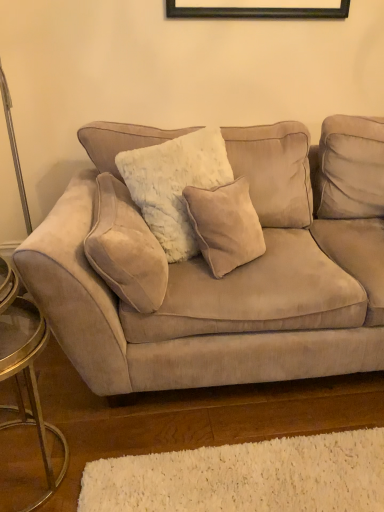
Question: From the image's perspective, is beige suede pillow at left beneath suede couch at center?

Choices:
 (A) no
 (B) yes

Answer: (B)

Question: Is beige suede pillow at left taller than suede couch at center?

Choices:
 (A) yes
 (B) no

Answer: (B)

Question: Does beige suede pillow at left have a greater width compared to suede couch at center?

Choices:
 (A) yes
 (B) no

Answer: (B)

Question: Does beige suede pillow at left have a smaller size compared to suede couch at center?

Choices:
 (A) yes
 (B) no

Answer: (A)

Question: Is beige suede pillow at left at the right side of suede couch at center?

Choices:
 (A) yes
 (B) no

Answer: (B)

Question: From the image's perspective, is beige suede pillow at left above or below white shag rug at lower center?

Choices:
 (A) above
 (B) below

Answer: (A)

Question: Is beige suede pillow at left to the left or to the right of white shag rug at lower center in the image?

Choices:
 (A) left
 (B) right

Answer: (A)

Question: Looking at their shapes, would you say beige suede pillow at left is wider or thinner than white shag rug at lower center?

Choices:
 (A) wide
 (B) thin

Answer: (B)

Question: In the image, is beige suede pillow at left positioned in front of or behind white shag rug at lower center?

Choices:
 (A) behind
 (B) front

Answer: (A)

Question: Based on their sizes in the image, would you say metallic gold side table at left is bigger or smaller than beige suede pillow at left?

Choices:
 (A) big
 (B) small

Answer: (A)

Question: From the image's perspective, is metallic gold side table at left located above or below beige suede pillow at left?

Choices:
 (A) above
 (B) below

Answer: (B)

Question: From a real-world perspective, is metallic gold side table at left physically located above or below beige suede pillow at left?

Choices:
 (A) above
 (B) below

Answer: (B)

Question: Is metallic gold side table at left inside or outside of beige suede pillow at left?

Choices:
 (A) inside
 (B) outside

Answer: (B)

Question: Which is correct: beige suede pillow at left is inside suede couch at center, or outside of it?

Choices:
 (A) outside
 (B) inside

Answer: (B)

Question: From the image's perspective, is beige suede pillow at left located above or below suede couch at center?

Choices:
 (A) above
 (B) below

Answer: (B)